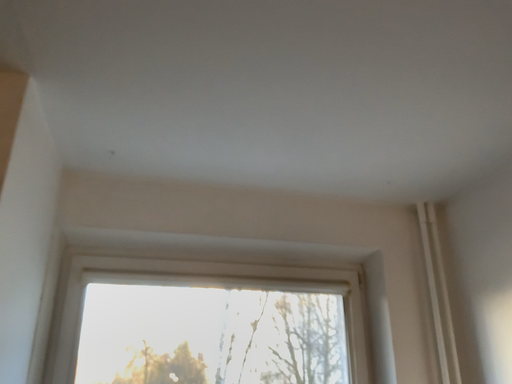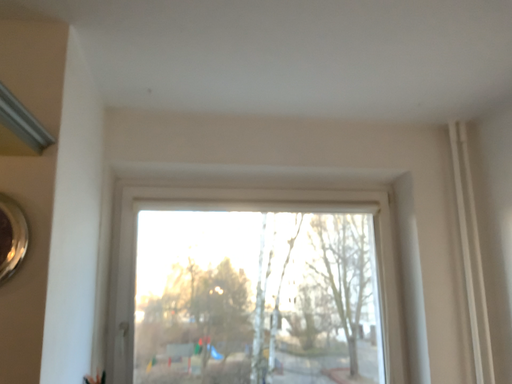
Question: How did the camera likely rotate when shooting the video?

Choices:
 (A) rotated upward
 (B) rotated downward

Answer: (B)